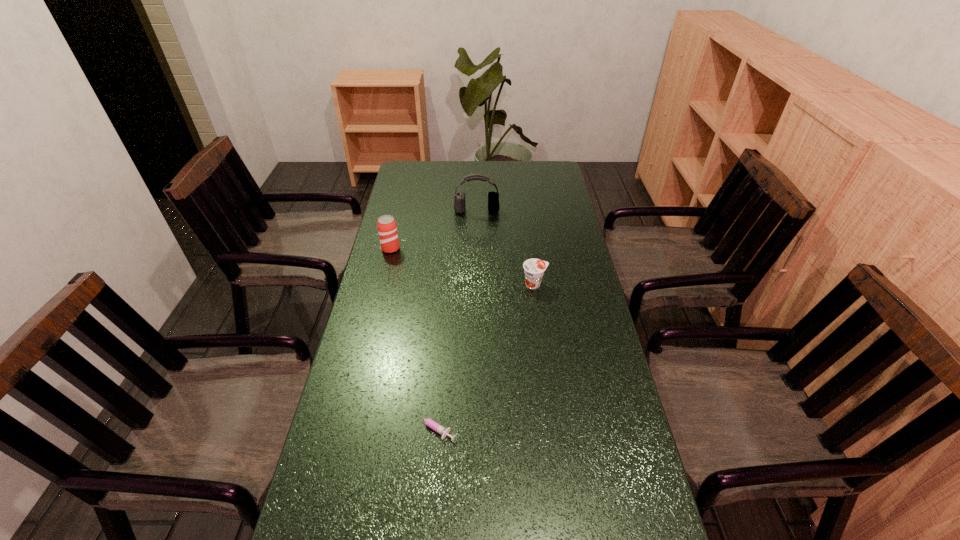
The image size is (960, 540). Identify the location of free space between the nearest object and the second farthest object. (412, 338).

Where is `empty space that is in between the shortest object and the leftmost object`? The width and height of the screenshot is (960, 540). empty space that is in between the shortest object and the leftmost object is located at coordinates (412, 338).

The width and height of the screenshot is (960, 540). In order to click on free space between the tallest object and the nearest object in this screenshot , I will do `click(454, 319)`.

At what (x,y) coordinates should I click in order to perform the action: click on free space that is in between the beer can and the shortest object. Please return your answer as a coordinate pair (x, y). The image size is (960, 540). Looking at the image, I should click on (412, 338).

Locate an element on the screen. vacant space that's between the shortest object and the third nearest object is located at coordinates (412, 338).

The height and width of the screenshot is (540, 960). I want to click on free space between the third nearest object and the tallest object, so click(x=434, y=230).

This screenshot has width=960, height=540. What are the coordinates of `free space between the headset and the yogurt` in the screenshot? It's located at (506, 247).

Locate an element on the screen. object that is the second closest to the third farthest object is located at coordinates (387, 229).

Locate an element on the screen. The image size is (960, 540). object that is the closest to the rightmost object is located at coordinates (459, 197).